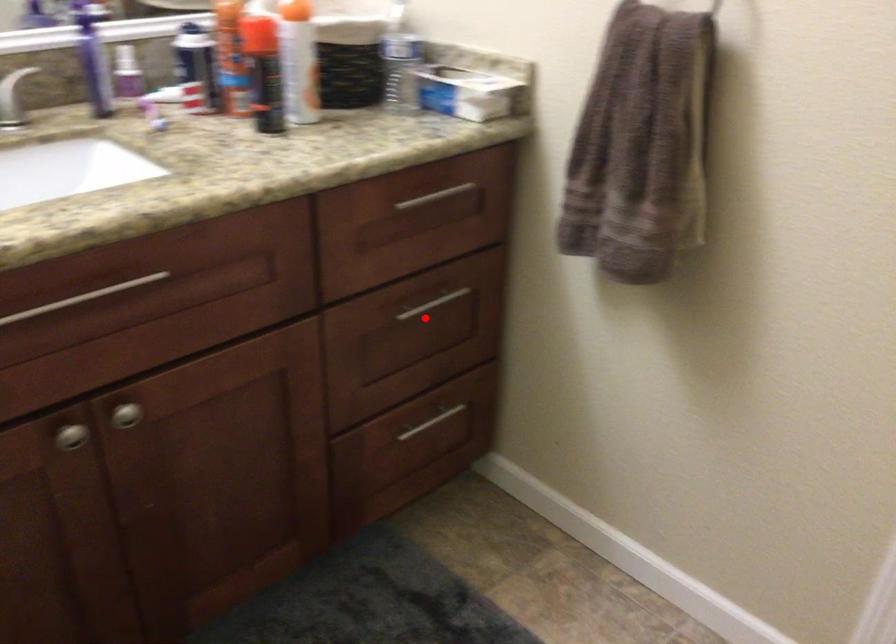
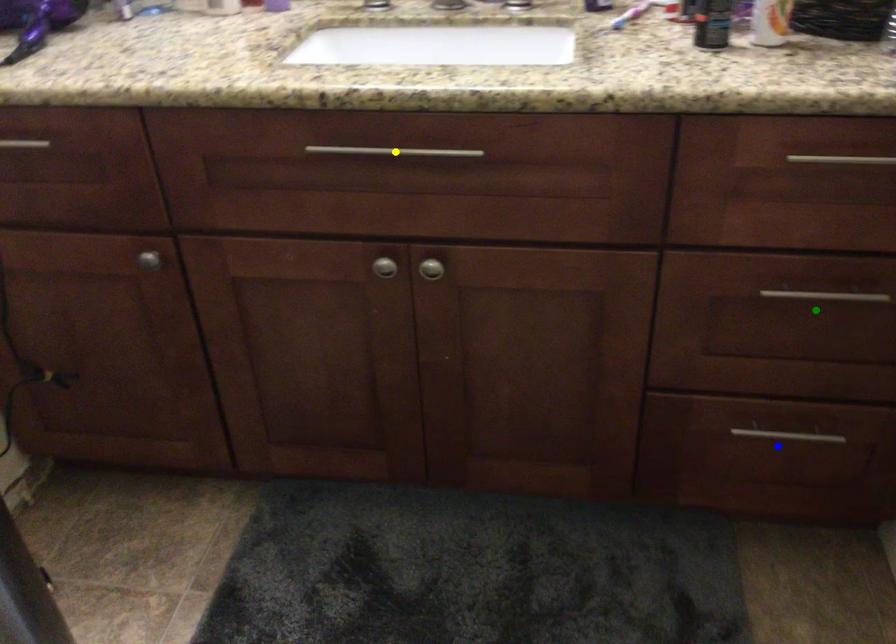
Question: I am providing you with two images of the same scene from different viewpoints. A red point is marked on the first image. You are given multiple points on the second image. Can you choose the point in image 2 that corresponds to the point in image 1?

Choices:
 (A) green point
 (B) blue point
 (C) yellow point

Answer: (A)